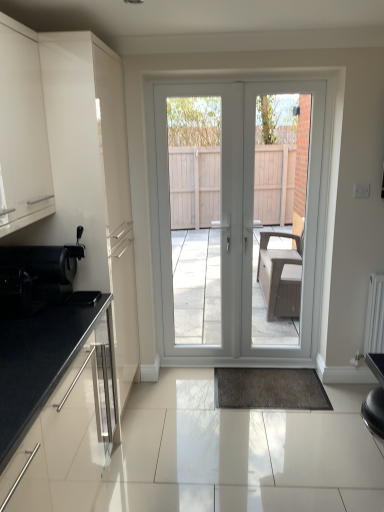
Question: Considering the positions of white plastic door at center, arranged as the second screen door when viewed from the left, and black granite countertop at lower left, arranged as the first cabinetry when ordered from the bottom, in the image, is white plastic door at center, arranged as the second screen door when viewed from the left, bigger or smaller than black granite countertop at lower left, arranged as the first cabinetry when ordered from the bottom,?

Choices:
 (A) big
 (B) small

Answer: (A)

Question: Considering their positions, is white plastic door at center, arranged as the second screen door when viewed from the left, located in front of or behind black granite countertop at lower left, arranged as the first cabinetry when ordered from the bottom?

Choices:
 (A) behind
 (B) front

Answer: (A)

Question: Estimate the real-world distances between objects in this image. Which object is closer to the white glossy door at center?

Choices:
 (A) shiny black coffee machine at left
 (B) white plastic door at center, arranged as the second screen door when viewed from the left
 (C) white glossy door at center, the first screen door viewed from the left
 (D) black granite countertop at lower left, positioned as the second cabinetry in top-to-bottom order
 (E) matte white cabinet at left, the second cabinetry from the bottom

Answer: (C)

Question: Which object is positioned farthest from the white plastic door at center, arranged as the second screen door when viewed from the left?

Choices:
 (A) white glossy door at center
 (B) shiny black coffee machine at left
 (C) black granite countertop at lower left, arranged as the first cabinetry when ordered from the bottom
 (D) white glossy door at center, the first screen door viewed from the left
 (E) matte white cabinet at left, the second cabinetry from the bottom

Answer: (C)